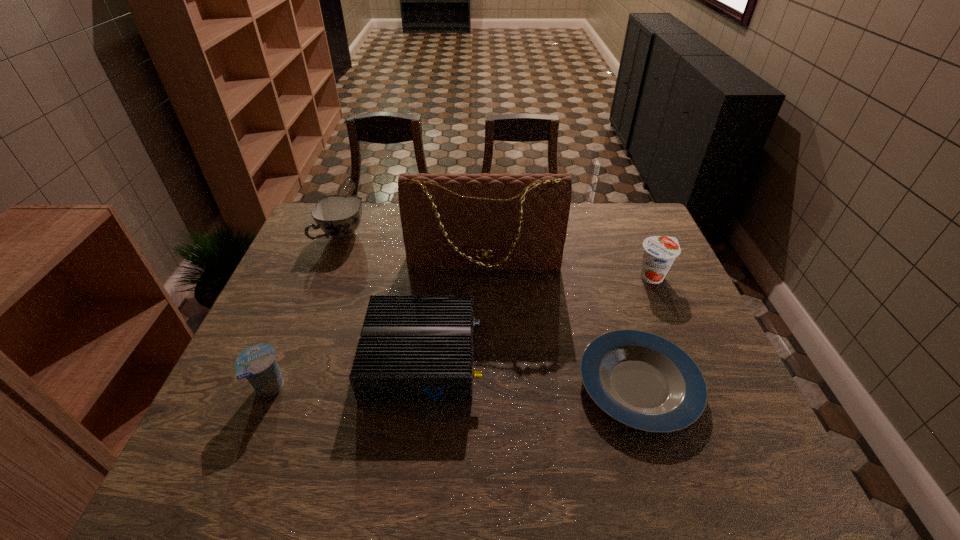
Identify the location of unoccupied position between the farther yogurt and the router. Image resolution: width=960 pixels, height=540 pixels. (538, 317).

This screenshot has width=960, height=540. In order to click on empty space between the shortest object and the handbag in this screenshot , I will do `click(562, 323)`.

You are a GUI agent. You are given a task and a screenshot of the screen. Output one action in this format:
    pyautogui.click(x=<x>, y=<y>)
    Task: Click on the free space between the shortest object and the router
    
    Given the screenshot: What is the action you would take?
    pyautogui.click(x=531, y=371)

Locate an element on the screen. This screenshot has height=540, width=960. unoccupied position between the nearer yogurt and the chinaware is located at coordinates (305, 313).

Locate an element on the screen. The width and height of the screenshot is (960, 540). the fourth closest object to the chinaware is located at coordinates (644, 381).

Where is `the closest object to the farther yogurt`? The image size is (960, 540). the closest object to the farther yogurt is located at coordinates (644, 381).

The height and width of the screenshot is (540, 960). Identify the location of vacant area that satisfies the following two spatial constraints: 1. on the back side of the farther yogurt; 2. on the left side of the shortest object. (605, 276).

Image resolution: width=960 pixels, height=540 pixels. In order to click on vacant space that satisfies the following two spatial constraints: 1. on the back panel of the router; 2. on the back side of the plate in this screenshot , I will do `click(419, 384)`.

This screenshot has height=540, width=960. What are the coordinates of `free point that satisfies the following two spatial constraints: 1. on the back side of the shortest object; 2. on the back panel of the router` in the screenshot? It's located at (630, 357).

This screenshot has width=960, height=540. Find the location of `free spot that satisfies the following two spatial constraints: 1. on the back side of the left yogurt; 2. on the right side of the chinaware`. free spot that satisfies the following two spatial constraints: 1. on the back side of the left yogurt; 2. on the right side of the chinaware is located at coordinates (333, 236).